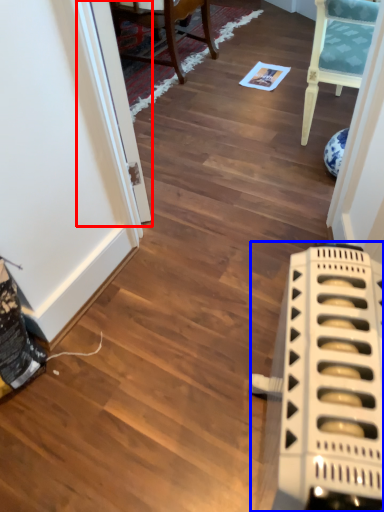
Question: Which of the following is the farthest to the observer, glass door (highlighted by a red box) or appliance (highlighted by a blue box)?

Choices:
 (A) glass door
 (B) appliance

Answer: (A)